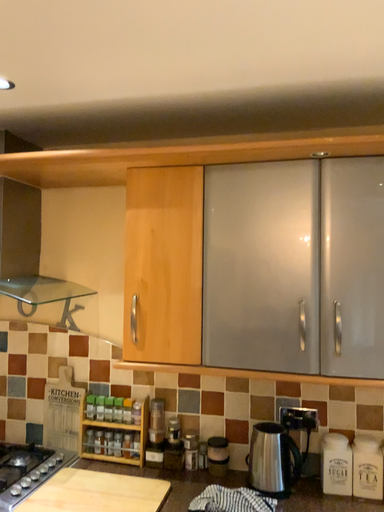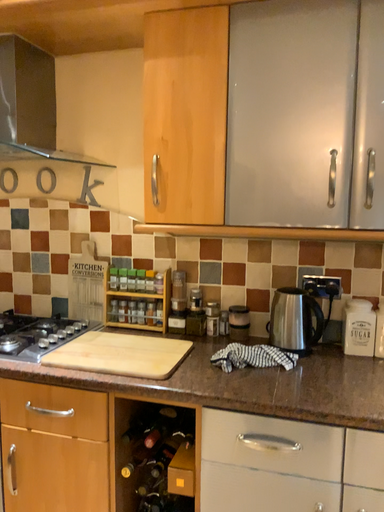
Question: How did the camera likely rotate when shooting the video?

Choices:
 (A) rotated downward
 (B) rotated upward

Answer: (A)